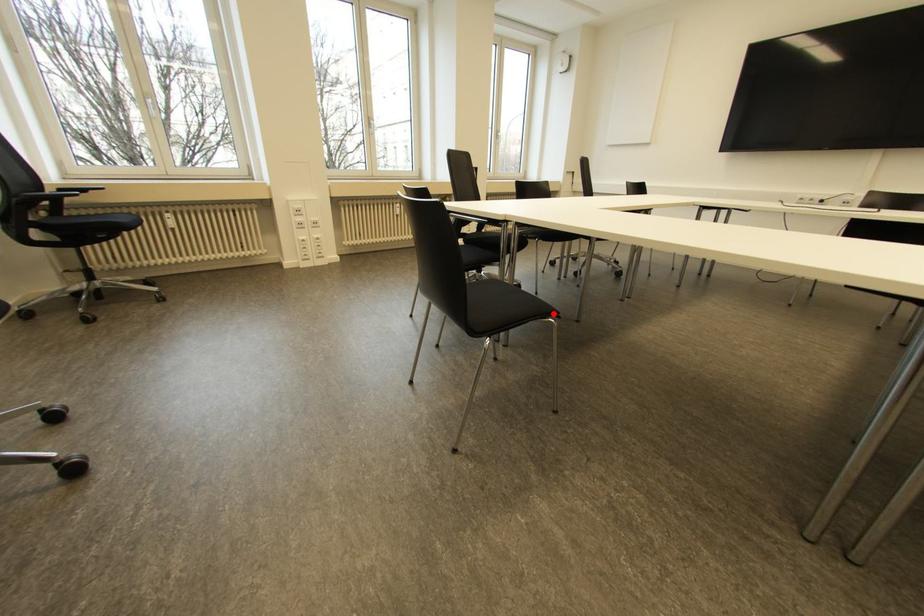
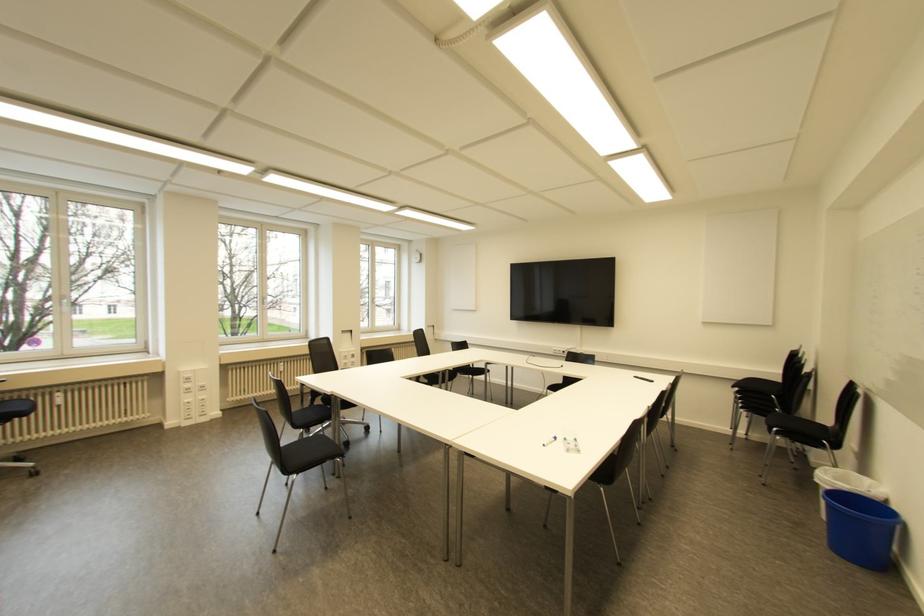
Where in the second image is the point corresponding to the highlighted location from the first image?

(342, 455)